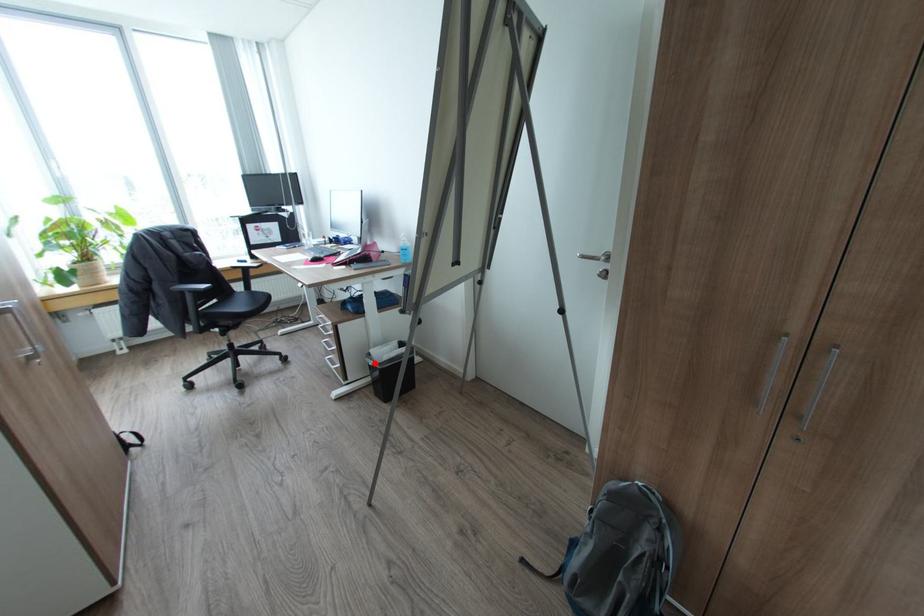
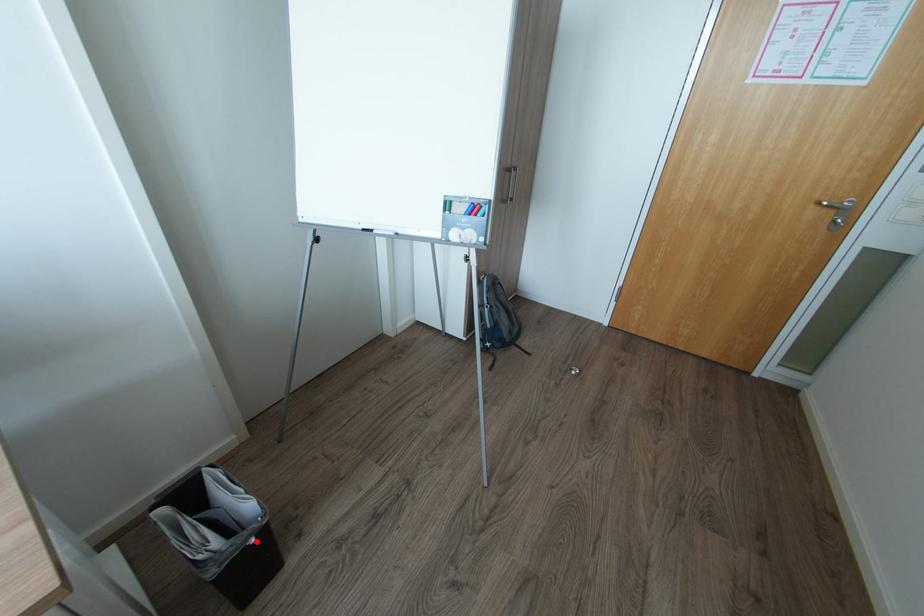
I am providing you with two images of the same scene from different viewpoints. A red point is marked on the first image and another point is marked on the second image. Is the marked point in image1 the same physical position as the marked point in image2?

Yes